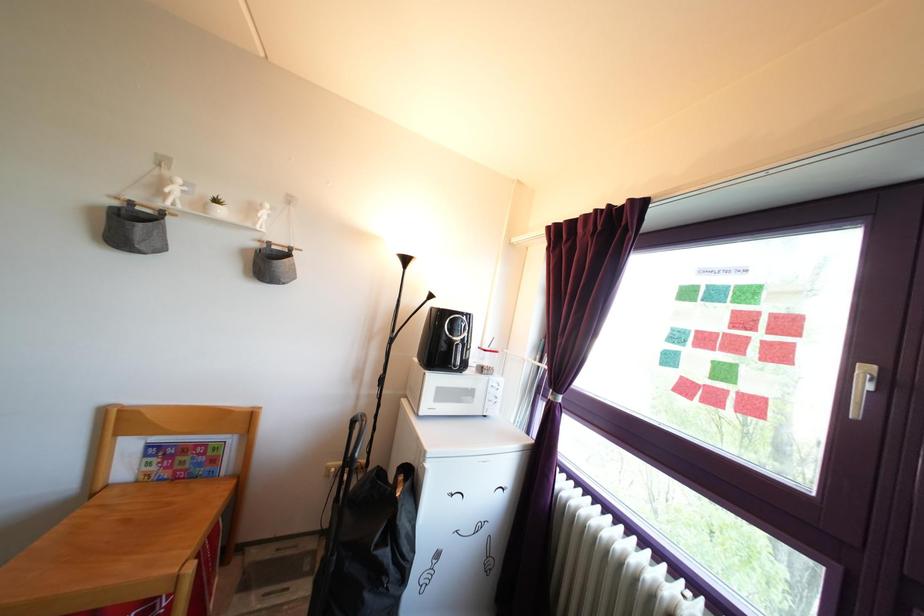
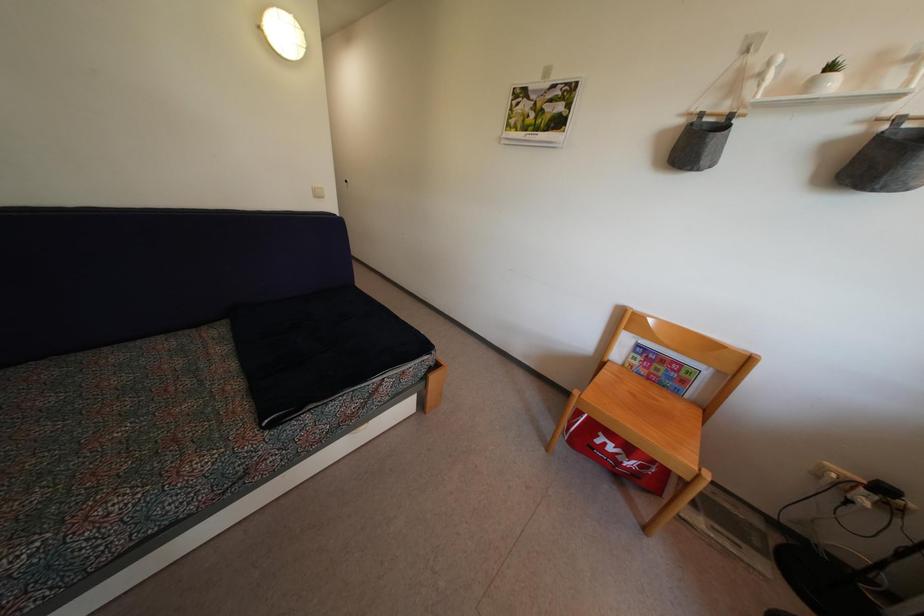
The first image is from the beginning of the video and the second image is from the end. How did the camera likely rotate when shooting the video?

The rotation direction of the camera is left-down.